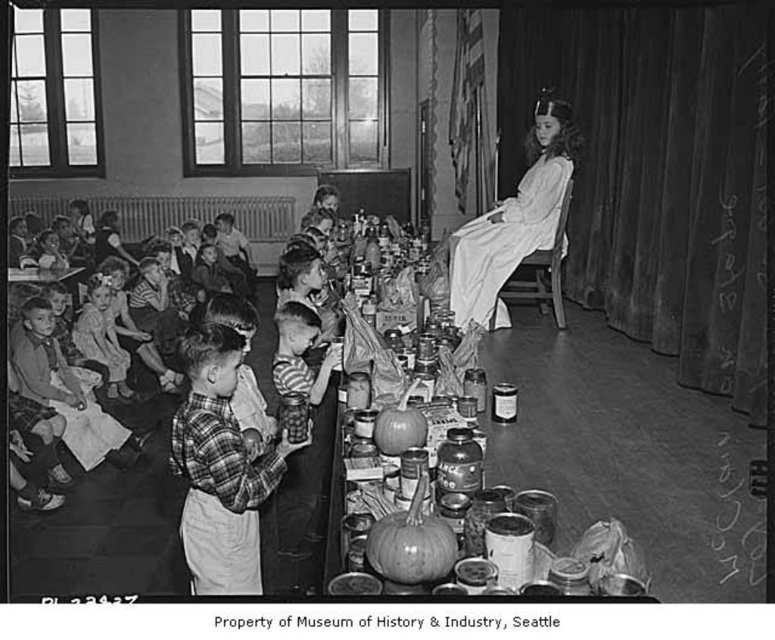
Looking at this image, is white satin dress at center smaller than smooth wooden table at center?

No.

Is point (450, 275) positioned after point (563, 541)?

Yes, it is behind point (563, 541).

Is point (558, 147) less distant than point (331, 451)?

No, it is not.

The width and height of the screenshot is (775, 640). I want to click on white satin dress at center, so click(512, 221).

From the picture: Between white satin dress at center and plaid shirt at lower left, which one has more height?

Standing taller between the two is white satin dress at center.

Between point (536, 232) and point (104, 321), which one is positioned in front?

Point (536, 232) is in front.

Image resolution: width=775 pixels, height=640 pixels. Find the location of `white satin dress at center`. white satin dress at center is located at coordinates (512, 221).

Can you confirm if plaid fabric shirt at center is positioned to the left of white satin dress at center?

Yes, plaid fabric shirt at center is to the left of white satin dress at center.

Which is behind, point (205, 440) or point (505, 237)?

The point (505, 237) is more distant.

The height and width of the screenshot is (640, 775). Identify the location of plaid fabric shirt at center. (219, 468).